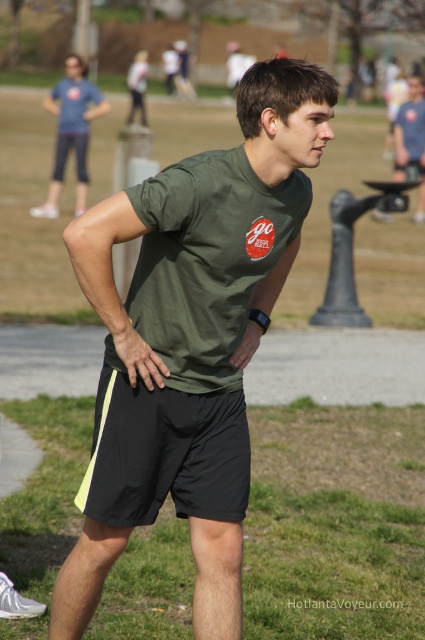
Does green matte shorts at lower center have a smaller size compared to matte blue jeans at upper left?

Actually, green matte shorts at lower center might be larger than matte blue jeans at upper left.

I want to click on green matte shorts at lower center, so click(x=334, y=524).

Does green matte t-shirt at center have a lesser width compared to matte blue jeans at upper left?

In fact, green matte t-shirt at center might be wider than matte blue jeans at upper left.

Is green matte t-shirt at center positioned behind matte blue jeans at upper left?

No, it is in front of matte blue jeans at upper left.

The width and height of the screenshot is (425, 640). I want to click on green matte t-shirt at center, so click(x=190, y=339).

How distant is green matte shorts at lower center from black/waterproof shorts at center?

A distance of 6.57 feet exists between green matte shorts at lower center and black/waterproof shorts at center.

Does green matte shorts at lower center appear on the left side of black/waterproof shorts at center?

In fact, green matte shorts at lower center is to the right of black/waterproof shorts at center.

Who is more distant from viewer, (407, 528) or (121, 465)?

Point (407, 528)

Where is `green matte shorts at lower center`? Image resolution: width=425 pixels, height=640 pixels. green matte shorts at lower center is located at coordinates (334, 524).